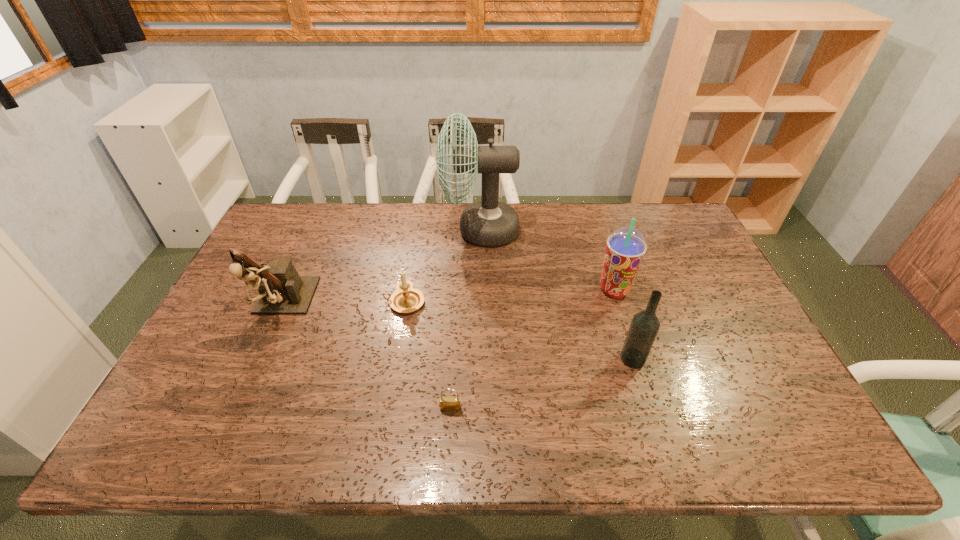
I want to click on free point located in front of the fan where the airflow is directed, so click(x=328, y=230).

Where is `vacant space located in front of the fan where the airflow is directed`? The image size is (960, 540). vacant space located in front of the fan where the airflow is directed is located at coordinates (419, 230).

I want to click on blank space located on the front-facing side of the figurine, so click(x=233, y=417).

Locate an element on the screen. The height and width of the screenshot is (540, 960). free space located 0.310m on the back of the smoothie is located at coordinates (591, 218).

The width and height of the screenshot is (960, 540). I want to click on vacant area located on the left of the vodka, so click(x=488, y=359).

Find the location of a particular element. vacant space situated 0.260m with a handle on the side of the fifth tallest object is located at coordinates (294, 303).

Where is `vacant area situated with a handle on the side of the fifth tallest object`? The image size is (960, 540). vacant area situated with a handle on the side of the fifth tallest object is located at coordinates (269, 303).

Find the location of a particular element. This screenshot has width=960, height=540. free space located with a handle on the side of the fifth tallest object is located at coordinates (335, 303).

This screenshot has width=960, height=540. I want to click on object located at the far edge, so click(489, 222).

This screenshot has height=540, width=960. Identify the location of object located in the left edge section of the desktop. (281, 290).